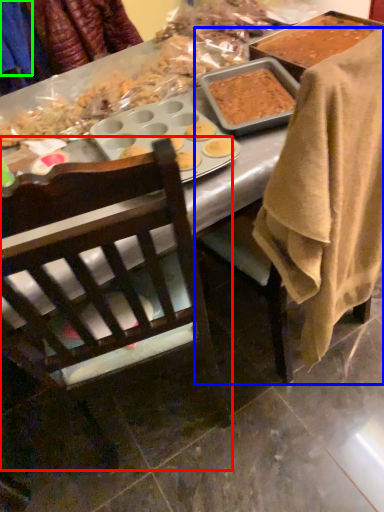
Question: Which object is the closest to the chair (highlighted by a red box)? Choose among these: chair (highlighted by a blue box) or clothing (highlighted by a green box).

Choices:
 (A) chair
 (B) clothing

Answer: (A)